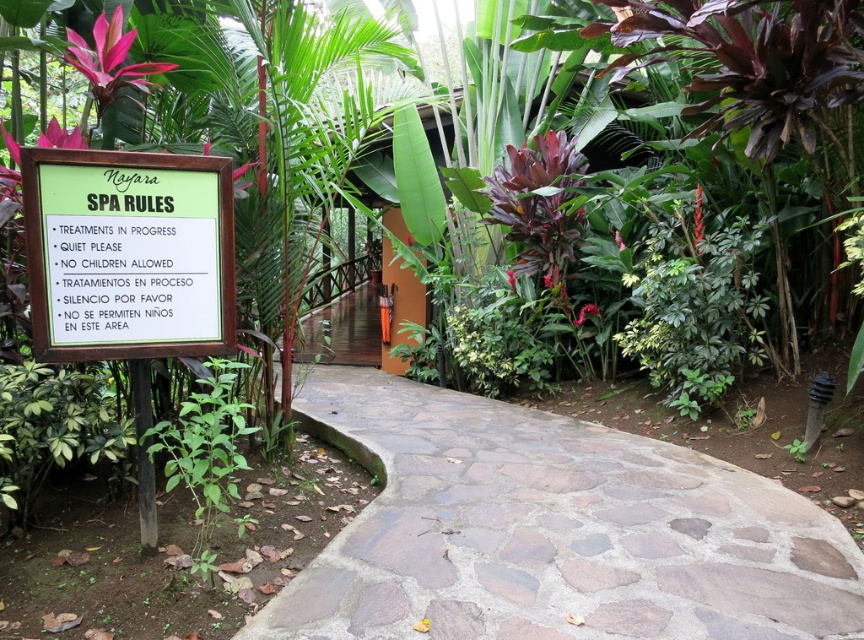
Question: Does natural stone pathway at center have a greater width compared to green wooden sign at upper left?

Choices:
 (A) no
 (B) yes

Answer: (B)

Question: Which of the following is the farthest from the observer?

Choices:
 (A) (278, 609)
 (B) (213, 422)

Answer: (A)

Question: Which object appears closest to the camera in this image?

Choices:
 (A) green leafy plant at lower left
 (B) green wooden sign at upper left
 (C) natural stone pathway at center

Answer: (B)

Question: Based on their relative distances, which object is farther from the natural stone pathway at center?

Choices:
 (A) green leafy plant at lower left
 (B) green wooden sign at upper left

Answer: (B)

Question: Where is natural stone pathway at center located in relation to green leafy plant at lower left in the image?

Choices:
 (A) right
 (B) left

Answer: (A)

Question: Is natural stone pathway at center smaller than green wooden sign at upper left?

Choices:
 (A) no
 (B) yes

Answer: (A)